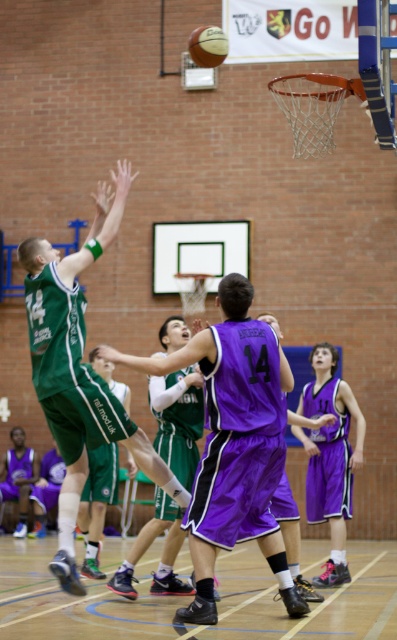
Does purple jersey at lower left have a larger size compared to rubber textured basketball at upper center?

Yes.

Can you confirm if purple jersey at lower left is shorter than rubber textured basketball at upper center?

Incorrect, purple jersey at lower left's height does not fall short of rubber textured basketball at upper center's.

Is point (11, 452) less distant than point (202, 40)?

No, it is not.

Identify the location of purple jersey at lower left. (19, 476).

Is purple shiny shorts at center positioned before green jersey at center?

Yes.

Is purple shiny shorts at center bigger than green jersey at center?

Correct, purple shiny shorts at center is larger in size than green jersey at center.

Which is in front, point (296, 429) or point (92, 456)?

Point (296, 429) is in front.

This screenshot has height=640, width=397. I want to click on purple shiny shorts at center, so point(331,458).

Can you confirm if purple shiny jersey at center is thinner than purple shiny shorts at center?

No, purple shiny jersey at center is not thinner than purple shiny shorts at center.

Which is behind, point (84, 419) or point (323, 374)?

Positioned behind is point (323, 374).

Describe the element at coordinates (80, 371) in the screenshot. I see `purple shiny jersey at center` at that location.

This screenshot has height=640, width=397. In order to click on purple shiny jersey at center in this screenshot , I will do pyautogui.click(x=80, y=371).